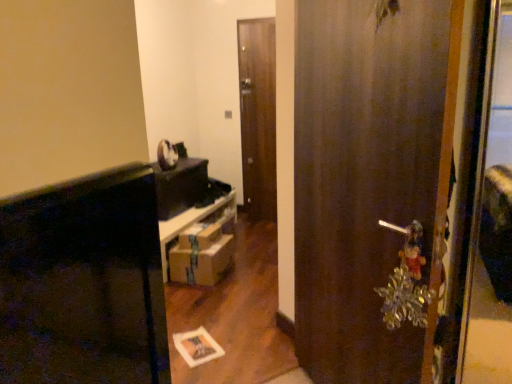
Identify the location of brown cardboard boxes at center. [199, 236].

The height and width of the screenshot is (384, 512). Find the location of `wooden door at center, which is the second door from right to left`. wooden door at center, which is the second door from right to left is located at coordinates (258, 116).

This screenshot has height=384, width=512. What do you see at coordinates (202, 262) in the screenshot?
I see `brown cardboard drawer at center` at bounding box center [202, 262].

At what (x,y) coordinates should I click in order to perform the action: click on wooden door at center, which is counted as the 1th door, starting from the front. Please return your answer as a coordinate pair (x, y). Looking at the image, I should click on (365, 179).

This screenshot has width=512, height=384. I want to click on box lying on the left of wooden door at center, which ranks as the first door in left-to-right order, so click(x=199, y=236).

From the image's perspective, would you say wooden door at center, which is the second door in front-to-back order, is positioned over brown cardboard boxes at center?

Indeed, from the image's perspective, wooden door at center, which is the second door in front-to-back order, is shown above brown cardboard boxes at center.

Based on the photo, from a real-world perspective, is wooden door at center, which is the second door from right to left, positioned above or below brown cardboard boxes at center?

Clearly, from a real-world perspective, wooden door at center, which is the second door from right to left, is above brown cardboard boxes at center.

Is brown cardboard boxes at center looking in the opposite direction of wooden door at center, which is the second door in front-to-back order?

That's not correct — brown cardboard boxes at center is not looking away from wooden door at center, which is the second door in front-to-back order.

From the picture: Is brown cardboard boxes at center thinner than wooden door at center, which is the second door from right to left?

No, brown cardboard boxes at center is not thinner than wooden door at center, which is the second door from right to left.

Considering the relative sizes of brown cardboard boxes at center and wooden door at center, which is the second door in front-to-back order, in the image provided, is brown cardboard boxes at center smaller than wooden door at center, which is the second door in front-to-back order,?

Correct, brown cardboard boxes at center occupies less space than wooden door at center, which is the second door in front-to-back order.

Which is more to the right, brown cardboard boxes at center or wooden door at center, which ranks as the 1th door in back-to-front order?

wooden door at center, which ranks as the 1th door in back-to-front order, is more to the right.

In the scene shown: Which of these two, wooden door at center, the first door viewed from the right, or brown cardboard drawer at center, is wider?

brown cardboard drawer at center is wider.

Can you confirm if wooden door at center, which is counted as the 1th door, starting from the front, is smaller than brown cardboard drawer at center?

Actually, wooden door at center, which is counted as the 1th door, starting from the front, might be larger than brown cardboard drawer at center.

Considering the positions of objects wooden door at center, which is counted as the 1th door, starting from the front, and brown cardboard drawer at center in the image provided, who is more to the left, wooden door at center, which is counted as the 1th door, starting from the front, or brown cardboard drawer at center?

From the viewer's perspective, brown cardboard drawer at center appears more on the left side.

Considering the points (415, 337) and (178, 280), which point is behind, point (415, 337) or point (178, 280)?

Positioned behind is point (178, 280).

Is wooden door at center, which ranks as the 1th door in back-to-front order, not close to brown cardboard drawer at center?

That's right, there is a large distance between wooden door at center, which ranks as the 1th door in back-to-front order, and brown cardboard drawer at center.

Is wooden door at center, which is the second door in front-to-back order, in front of or behind brown cardboard drawer at center in the image?

Clearly, wooden door at center, which is the second door in front-to-back order, is behind brown cardboard drawer at center.

Who is smaller, wooden door at center, which ranks as the first door in left-to-right order, or brown cardboard drawer at center?

wooden door at center, which ranks as the first door in left-to-right order.

From the image's perspective, between wooden door at center, which is the second door from right to left, and brown cardboard drawer at center, who is located below?

brown cardboard drawer at center appears lower in the image.

Is wooden door at center, the first door viewed from the right, beside brown cardboard boxes at center?

wooden door at center, the first door viewed from the right, is not next to brown cardboard boxes at center, and they're not touching.

Which is farther from the camera, (x=351, y=64) or (x=192, y=241)?

Point (x=192, y=241)

Which is more to the left, wooden door at center, the first door viewed from the right, or brown cardboard boxes at center?

From the viewer's perspective, brown cardboard boxes at center appears more on the left side.

Which of these two, wooden door at center, which is counted as the 1th door, starting from the front, or brown cardboard boxes at center, is thinner?

wooden door at center, which is counted as the 1th door, starting from the front.

Does brown cardboard boxes at center appear on the left side of brown cardboard drawer at center?

Yes.

Which object is further away from the camera taking this photo, brown cardboard boxes at center or brown cardboard drawer at center?

Positioned behind is brown cardboard boxes at center.

How many degrees apart are the facing directions of brown cardboard boxes at center and brown cardboard drawer at center?

The angular difference between brown cardboard boxes at center and brown cardboard drawer at center is 0.000116 degrees.

Which of these two, wooden door at center, which is counted as the 1th door, starting from the front, or wooden door at center, which ranks as the first door in left-to-right order, stands shorter?

wooden door at center, which is counted as the 1th door, starting from the front, is shorter.

Is wooden door at center, the second door viewed from the back, in front of or behind wooden door at center, which is the second door in front-to-back order, in the image?

Clearly, wooden door at center, the second door viewed from the back, is in front of wooden door at center, which is the second door in front-to-back order.

Would you consider wooden door at center, the first door viewed from the right, to be distant from wooden door at center, which ranks as the first door in left-to-right order?

Yes, wooden door at center, the first door viewed from the right, and wooden door at center, which ranks as the first door in left-to-right order, are quite far apart.

The width and height of the screenshot is (512, 384). In order to click on the 1st door to the right of the brown cardboard boxes at center, counting from the anchor's position in this screenshot , I will do `click(258, 116)`.

Where is `door behind the brown cardboard boxes at center`? This screenshot has height=384, width=512. door behind the brown cardboard boxes at center is located at coordinates (258, 116).

Considering their positions, is wooden door at center, which appears as the 2th door when viewed from the left, positioned closer to wooden door at center, which is the second door from right to left, than brown cardboard boxes at center?

Among the two, brown cardboard boxes at center is located nearer to wooden door at center, which is the second door from right to left.

Based on their spatial positions, is wooden door at center, the second door viewed from the back, or wooden door at center, which ranks as the 1th door in back-to-front order, closer to brown cardboard drawer at center?

Based on the image, wooden door at center, which ranks as the 1th door in back-to-front order, appears to be nearer to brown cardboard drawer at center.

Looking at the image, which one is located closer to brown cardboard drawer at center, brown cardboard boxes at center or wooden door at center, which ranks as the first door in left-to-right order?

Based on the image, brown cardboard boxes at center appears to be nearer to brown cardboard drawer at center.

Considering their positions, is brown cardboard boxes at center positioned further to wooden door at center, which is the second door from right to left, than brown cardboard drawer at center?

Based on the image, brown cardboard drawer at center appears to be further to wooden door at center, which is the second door from right to left.

From the image, which object appears to be nearer to brown cardboard boxes at center, brown cardboard drawer at center or wooden door at center, which is the second door in front-to-back order?

brown cardboard drawer at center is closer to brown cardboard boxes at center.

Estimate the real-world distances between objects in this image. Which object is closer to wooden door at center, which ranks as the 1th door in back-to-front order, brown cardboard drawer at center or wooden door at center, which is counted as the 1th door, starting from the front?

The object closer to wooden door at center, which ranks as the 1th door in back-to-front order, is brown cardboard drawer at center.

Considering their positions, is brown cardboard boxes at center positioned closer to wooden door at center, the first door viewed from the right, than brown cardboard drawer at center?

brown cardboard drawer at center is positioned closer to the anchor wooden door at center, the first door viewed from the right.

From the image, which object appears to be farther from wooden door at center, which is the second door from right to left, brown cardboard boxes at center or wooden door at center, which is counted as the 1th door, starting from the front?

wooden door at center, which is counted as the 1th door, starting from the front, lies further to wooden door at center, which is the second door from right to left, than the other object.

I want to click on box between wooden door at center, the first door viewed from the right, and wooden door at center, which is the second door in front-to-back order, from front to back, so click(199, 236).

At what (x,y) coordinates should I click in order to perform the action: click on drawer between wooden door at center, which is counted as the 1th door, starting from the front, and brown cardboard boxes at center from front to back. Please return your answer as a coordinate pair (x, y). This screenshot has height=384, width=512. Looking at the image, I should click on (202, 262).

What are the coordinates of `box between brown cardboard drawer at center and wooden door at center, which ranks as the 1th door in back-to-front order, along the z-axis` in the screenshot? It's located at (199, 236).

At what (x,y) coordinates should I click in order to perform the action: click on drawer between wooden door at center, the second door viewed from the back, and wooden door at center, which is the second door in front-to-back order, from front to back. Please return your answer as a coordinate pair (x, y). Image resolution: width=512 pixels, height=384 pixels. Looking at the image, I should click on pos(202,262).